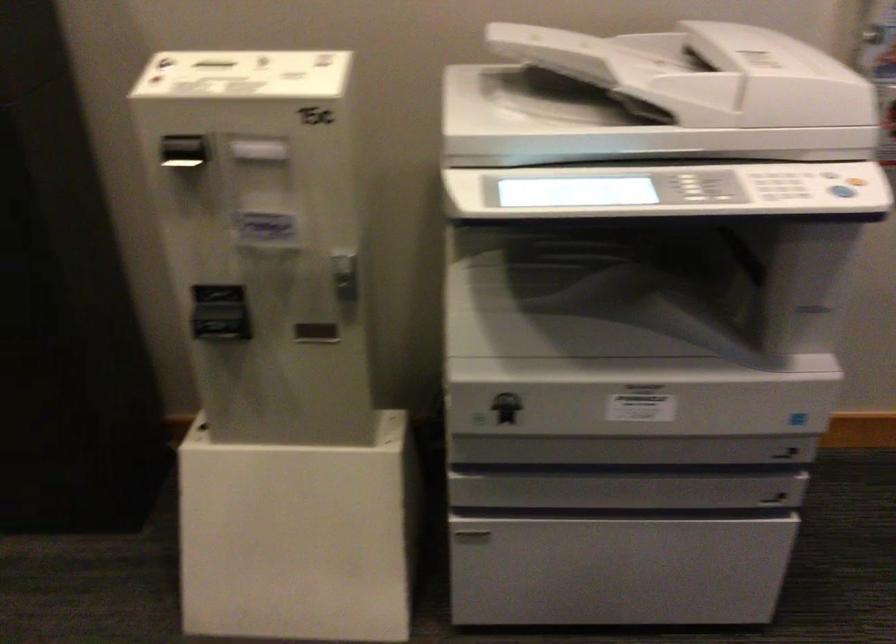
The height and width of the screenshot is (644, 896). In order to click on dispenser slot in this screenshot , I will do `click(315, 333)`.